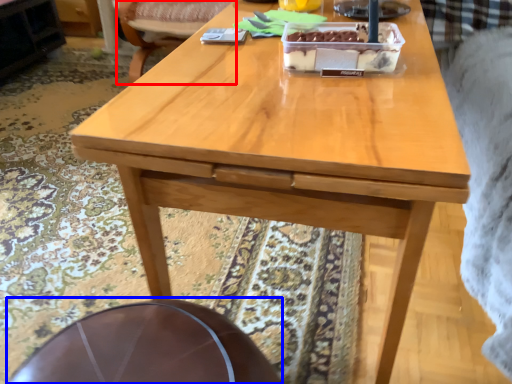
Question: Among these objects, which one is nearest to the camera, chair (highlighted by a red box) or round table (highlighted by a blue box)?

Choices:
 (A) chair
 (B) round table

Answer: (B)